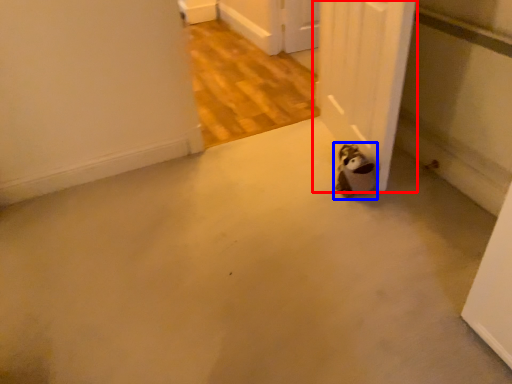
Question: Which of the following is the closest to the observer, door (highlighted by a red box) or animal (highlighted by a blue box)?

Choices:
 (A) door
 (B) animal

Answer: (A)